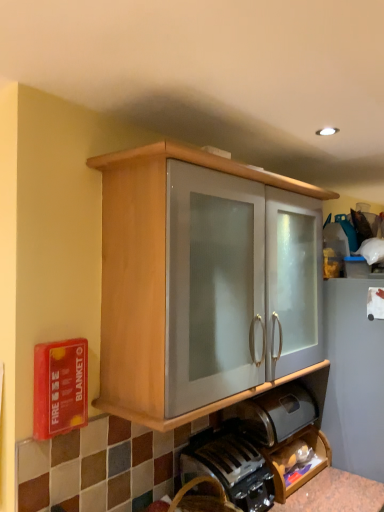
Question: Is black plastic coffee machine at lower center bigger than wooden cabinet at center?

Choices:
 (A) yes
 (B) no

Answer: (B)

Question: Is black plastic coffee machine at lower center looking in the opposite direction of wooden cabinet at center?

Choices:
 (A) yes
 (B) no

Answer: (B)

Question: Considering the relative sizes of black plastic coffee machine at lower center and wooden cabinet at center in the image provided, is black plastic coffee machine at lower center smaller than wooden cabinet at center?

Choices:
 (A) yes
 (B) no

Answer: (A)

Question: Is black plastic coffee machine at lower center thinner than wooden cabinet at center?

Choices:
 (A) no
 (B) yes

Answer: (B)

Question: Are black plastic coffee machine at lower center and wooden cabinet at center far apart?

Choices:
 (A) yes
 (B) no

Answer: (B)

Question: From the image's perspective, is satin silver bread bin at lower center located above or below wooden shelf at lower right?

Choices:
 (A) below
 (B) above

Answer: (B)

Question: Choose the correct answer: Is satin silver bread bin at lower center inside wooden shelf at lower right or outside it?

Choices:
 (A) outside
 (B) inside

Answer: (A)

Question: Is satin silver bread bin at lower center wider or thinner than wooden shelf at lower right?

Choices:
 (A) thin
 (B) wide

Answer: (B)

Question: In terms of height, does satin silver bread bin at lower center look taller or shorter compared to wooden shelf at lower right?

Choices:
 (A) tall
 (B) short

Answer: (B)

Question: Based on their sizes in the image, would you say satin silver bread bin at lower center is bigger or smaller than wooden cabinet at center?

Choices:
 (A) big
 (B) small

Answer: (B)

Question: Considering the positions of point (251, 413) and point (107, 265), is point (251, 413) closer or farther from the camera than point (107, 265)?

Choices:
 (A) closer
 (B) farther

Answer: (B)

Question: Is satin silver bread bin at lower center wider or thinner than wooden cabinet at center?

Choices:
 (A) thin
 (B) wide

Answer: (A)

Question: Is satin silver bread bin at lower center taller or shorter than wooden cabinet at center?

Choices:
 (A) short
 (B) tall

Answer: (A)

Question: From their relative heights in the image, would you say wooden cabinet at center is taller or shorter than satin silver bread bin at lower center?

Choices:
 (A) tall
 (B) short

Answer: (A)

Question: Is wooden cabinet at center situated inside satin silver bread bin at lower center or outside?

Choices:
 (A) outside
 (B) inside

Answer: (A)